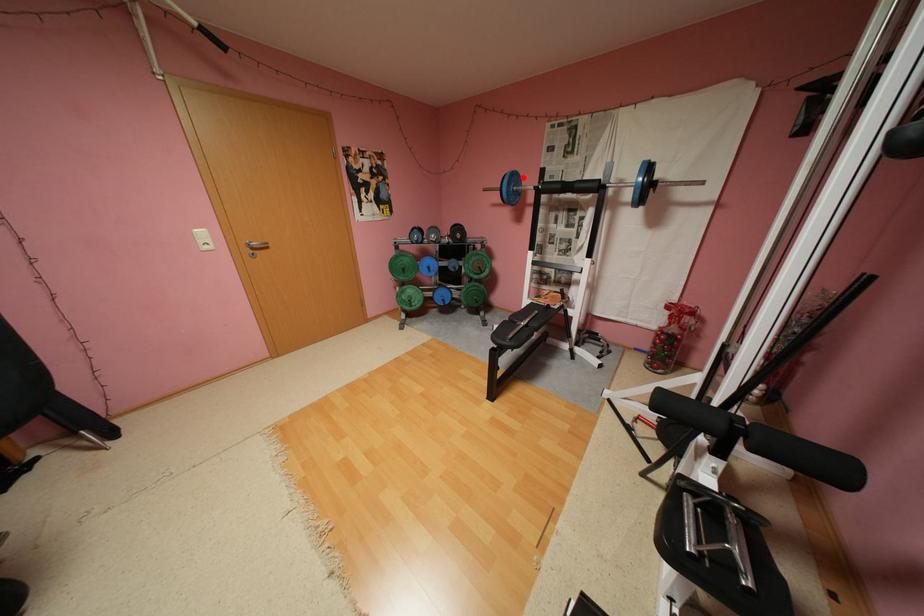
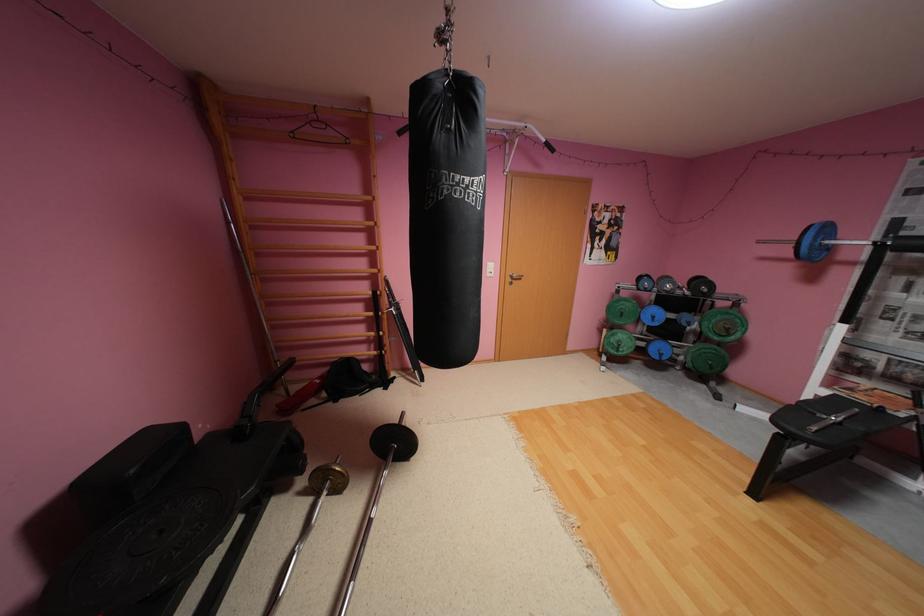
Question: I am providing you with two images of the same scene from different viewpoints. In image1, a red point is highlighted. Considering the same 3D point in image2, which of the following is correct?

Choices:
 (A) It is closer
 (B) It is farther

Answer: (B)